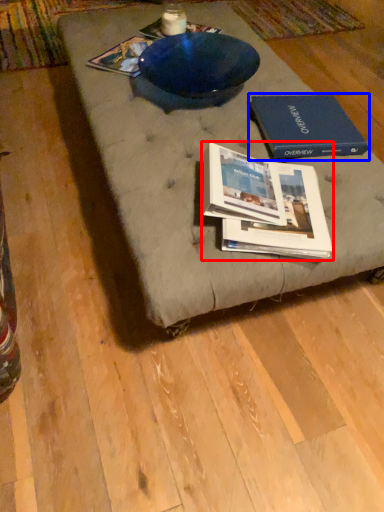
Question: Which object appears farthest to the camera in this image, book (highlighted by a red box) or paperback book (highlighted by a blue box)?

Choices:
 (A) book
 (B) paperback book

Answer: (B)